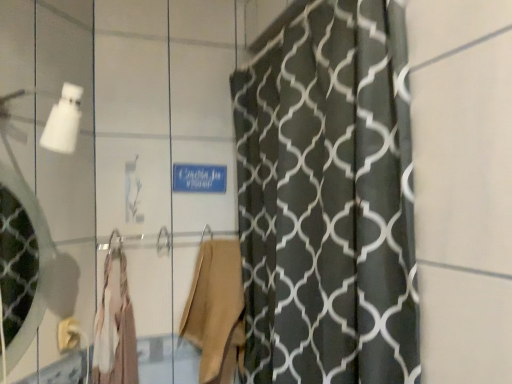
Question: Is clear glass mirror at left inside the boundaries of matte gold towel bar at lower left, or outside?

Choices:
 (A) inside
 (B) outside

Answer: (B)

Question: Is point (0, 201) positioned closer to the camera than point (57, 347)?

Choices:
 (A) closer
 (B) farther

Answer: (B)

Question: Based on their relative distances, which object is nearer to the matte gold towel bar at lower left?

Choices:
 (A) light beige fabric robe at center, acting as the second robe starting from the right
 (B) clear glass mirror at left
 (C) beige fabric robe at center, the 2th robe from the left

Answer: (A)

Question: Considering the real-world distances, which object is farthest from the clear glass mirror at left?

Choices:
 (A) matte gold towel bar at lower left
 (B) light beige fabric robe at center, which is counted as the first robe, starting from the left
 (C) beige fabric robe at center, which ranks as the 1th robe in right-to-left order

Answer: (C)